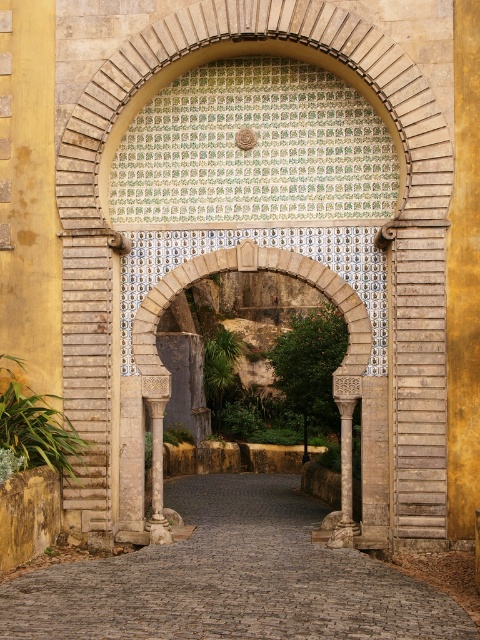
You are a tourist standing at the entrance of a historical site and see the brown cobblestone path at center and the stone archway at center. Which object is taller?

The stone archway at center is taller than the brown cobblestone path at center.

You are standing at the entrance of a historical site and see the brown cobblestone path at center and the stone archway at center ahead of you. Which object is closer to you?

The brown cobblestone path at center is closer to the viewer than the stone archway at center.

You are a tour guide leading a group through a historical site and want to ensure everyone can walk comfortably. You notice the brown cobblestone path at center and the marble column at center. Which one has a bigger footprint on the ground?

The brown cobblestone path at center has a larger footprint than the marble column at center because it is larger in size.